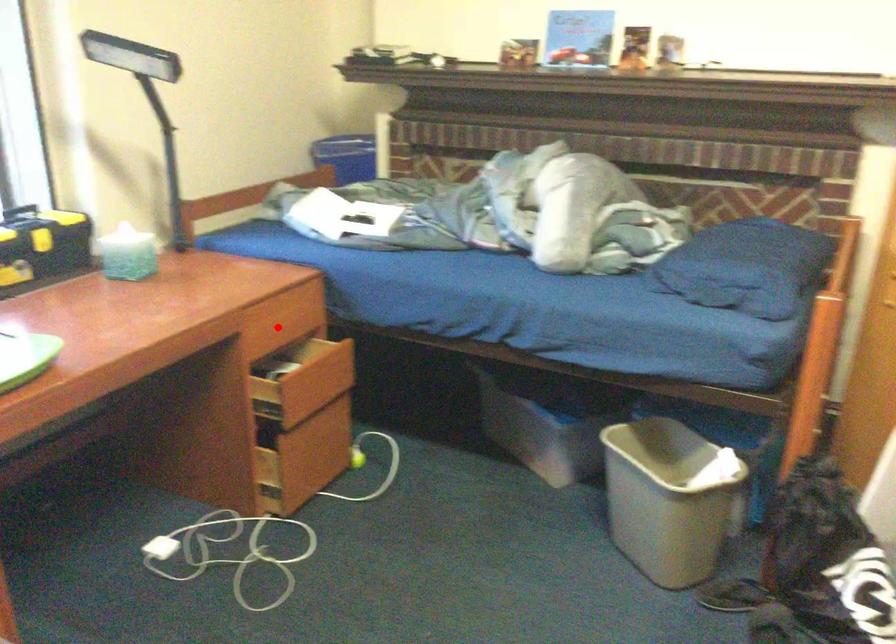
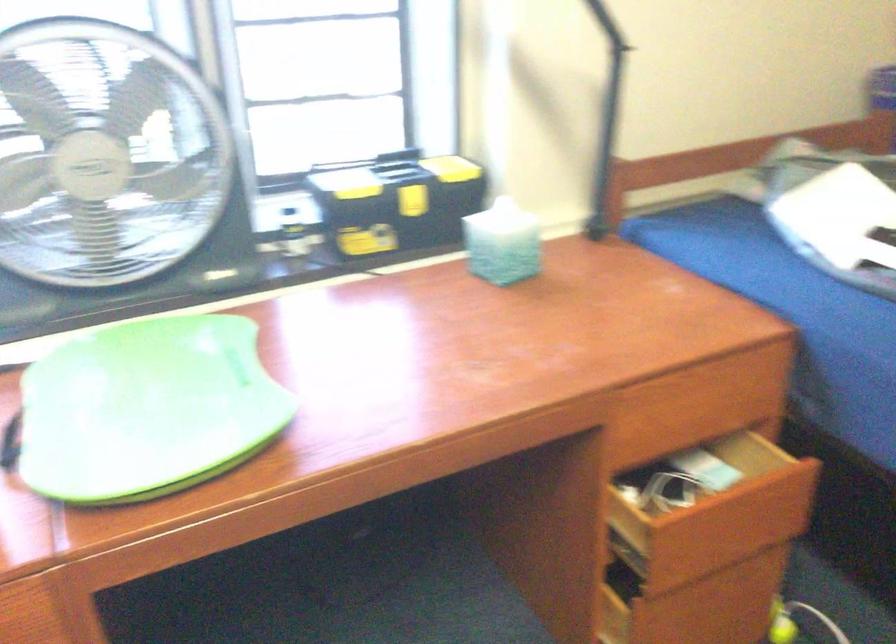
Find the pixel in the second image that matches the highlighted location in the first image.

(693, 415)